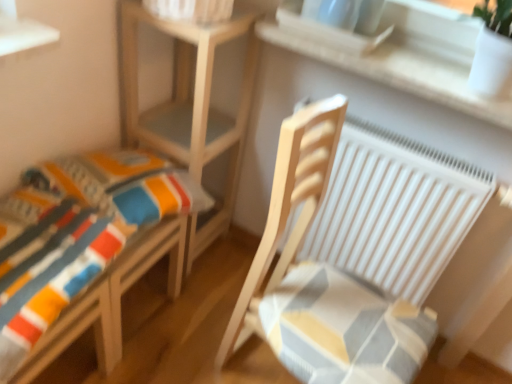
Question: Is natural wood table at center wider or thinner than striped fabric cushion at lower left?

Choices:
 (A) wide
 (B) thin

Answer: (B)

Question: Considering the positions of natural wood table at center and striped fabric cushion at lower left in the image, is natural wood table at center taller or shorter than striped fabric cushion at lower left?

Choices:
 (A) short
 (B) tall

Answer: (B)

Question: Which object is the closest to the striped fabric cushion at lower left?

Choices:
 (A) white matte radiator at right
 (B) wooden rocking chair at right
 (C) natural wood table at center
 (D) white stone window sill at upper center

Answer: (C)

Question: Considering the real-world distances, which object is farthest from the wooden rocking chair at right?

Choices:
 (A) striped fabric cushion at lower left
 (B) white matte radiator at right
 (C) natural wood table at center
 (D) white stone window sill at upper center

Answer: (C)